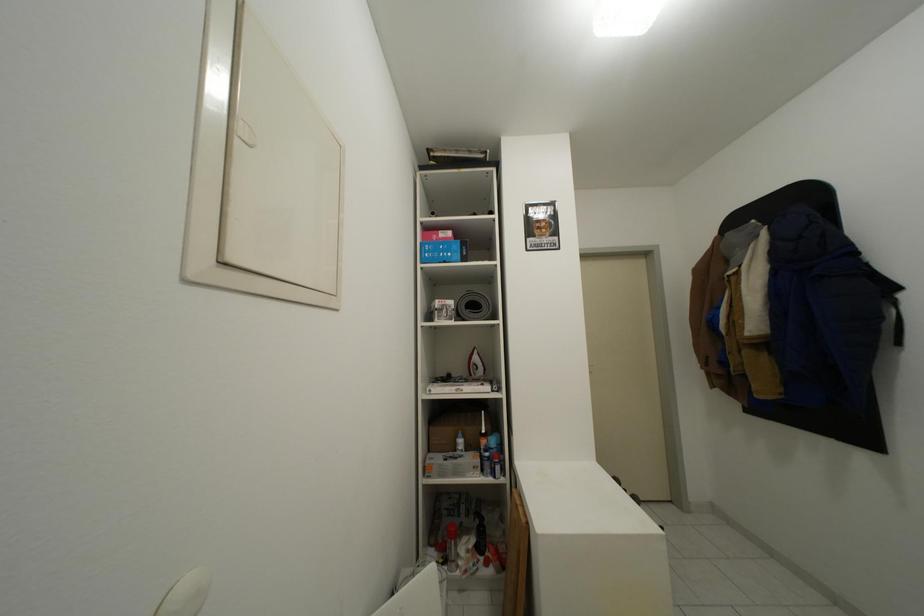
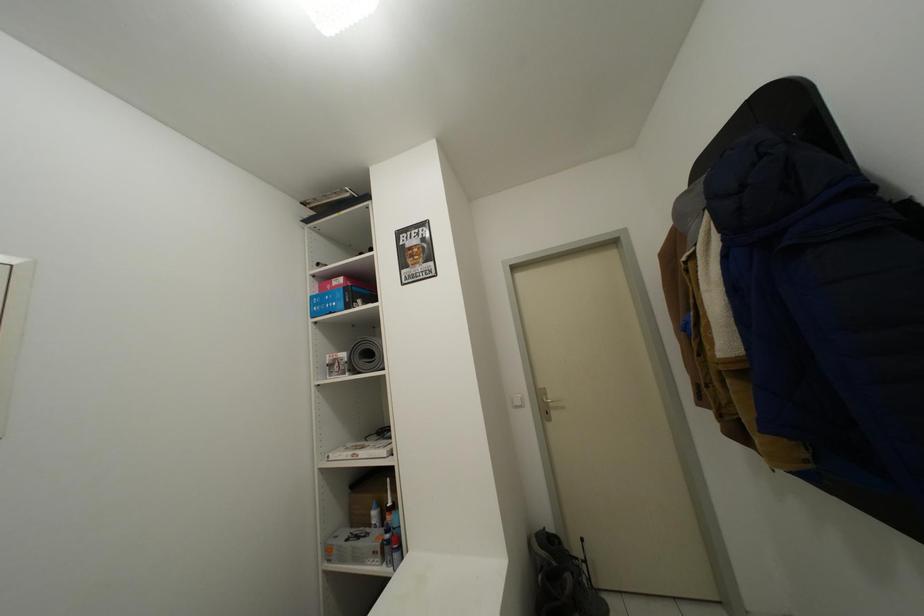
Question: Which direction would the cameraman need to move to produce the second image? Reply with the corresponding letter.

Choices:
 (A) Left
 (B) Right
 (C) Forward
 (D) Backward

Answer: (B)